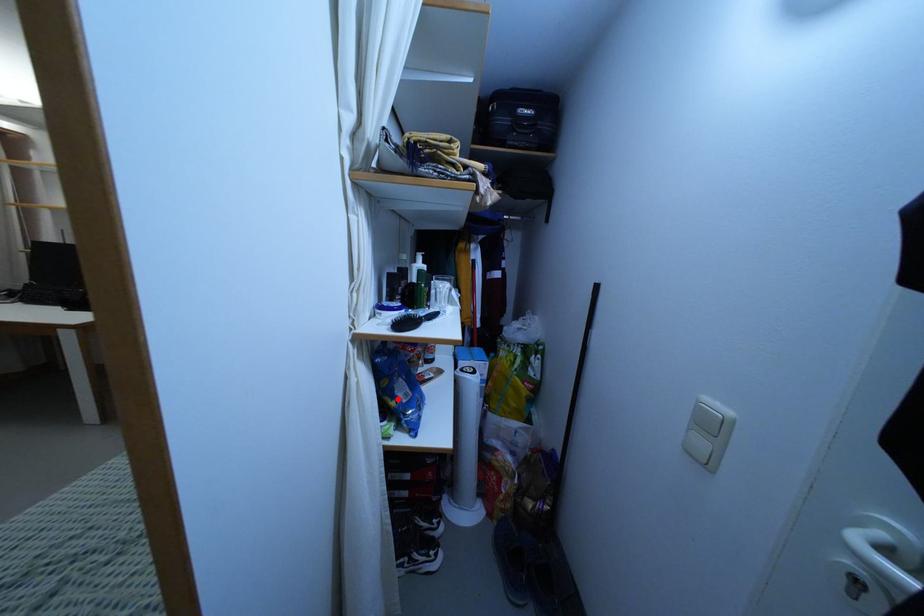
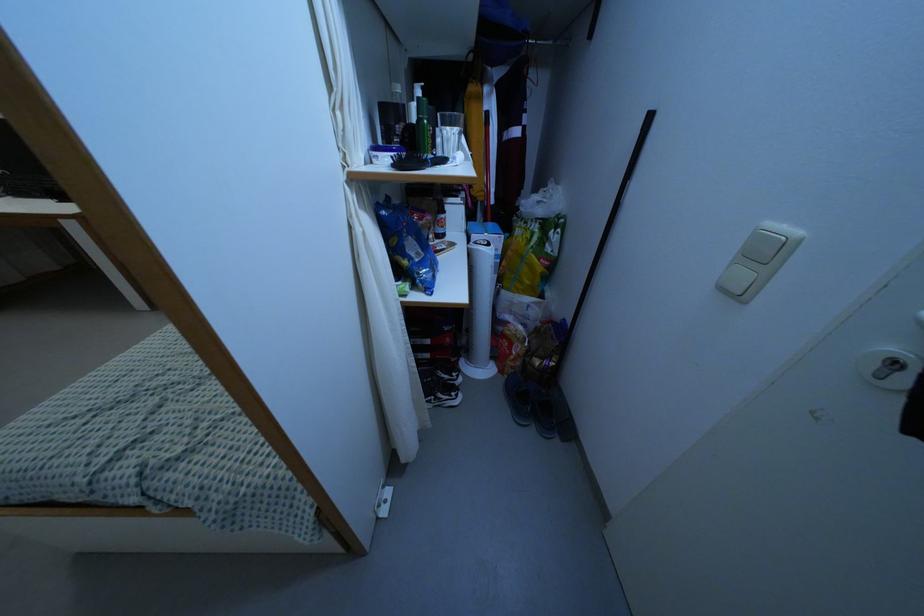
Where in the second image is the point corresponding to the highlighted location from the first image?

(409, 257)